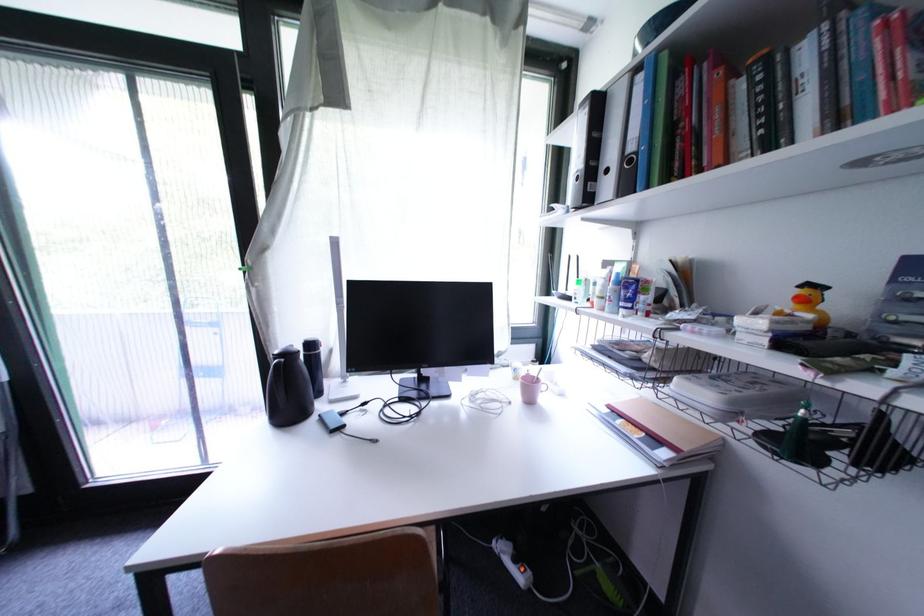
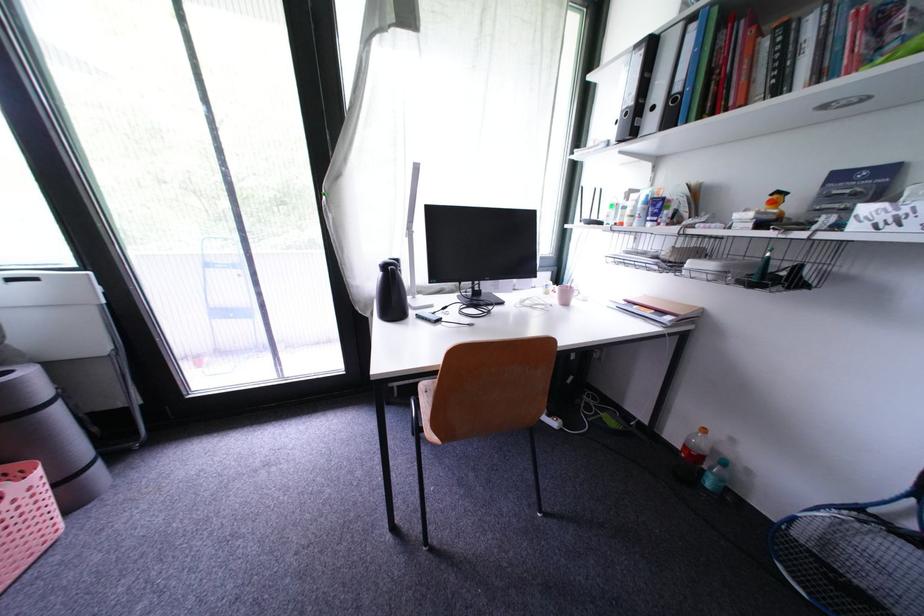
Locate, in the second image, the point that corresponds to (813,304) in the first image.

(782, 206)